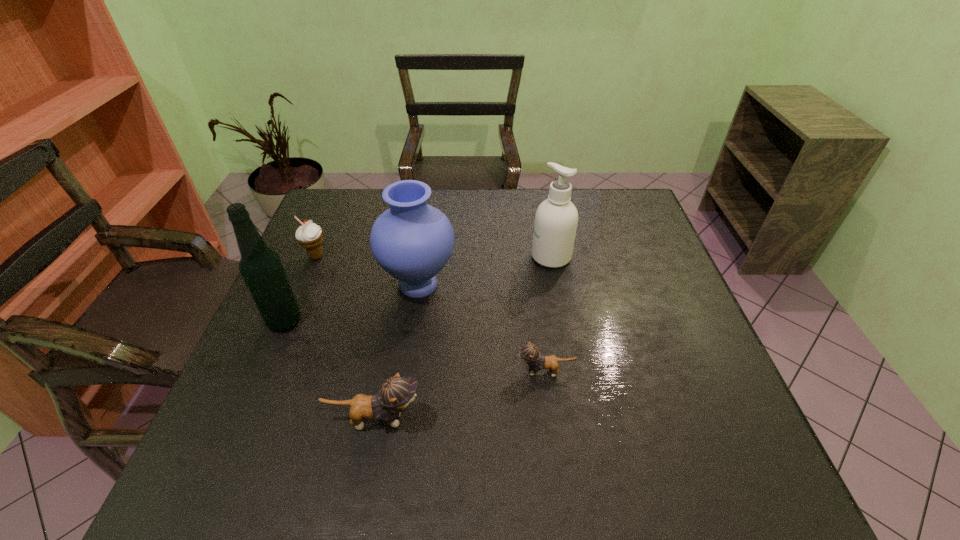
With all kittens evenly spaced, where should an extra kitten be placed on the right to continue the pattern? Please point out a vacant space. Please provide its 2D coordinates. Your answer should be formatted as a tuple, i.e. [(x, y)], where the tuple contains the x and y coordinates of a point satisfying the conditions above.

[(686, 331)]